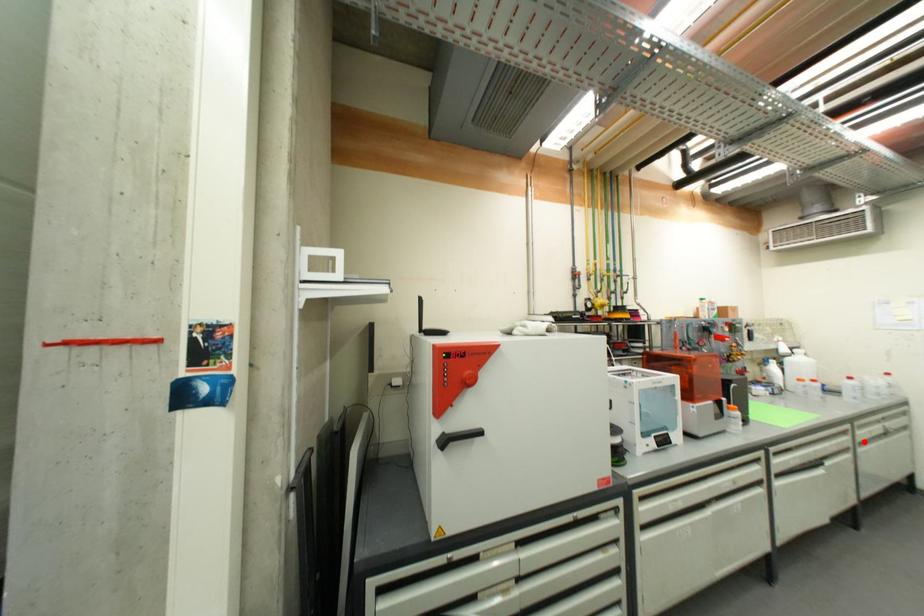
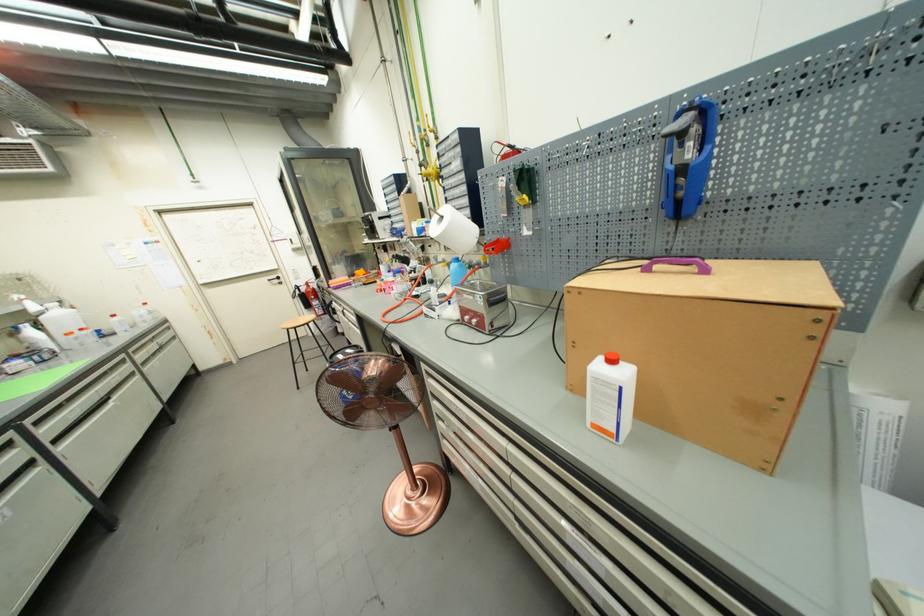
Question: I am providing you with two images of the same scene from different viewpoints. Given a red point in image1, look at the same physical point in image2. Is it:

Choices:
 (A) Closer to the viewpoint
 (B) Farther from the viewpoint

Answer: (B)